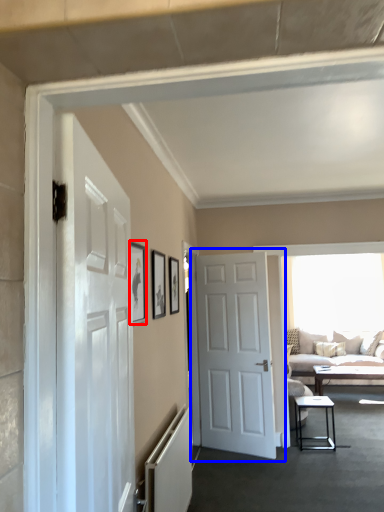
Question: Which object appears farthest to the camera in this image, picture frame (highlighted by a red box) or door (highlighted by a blue box)?

Choices:
 (A) picture frame
 (B) door

Answer: (B)